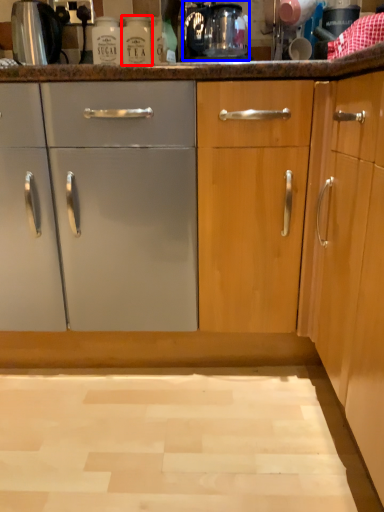
Question: Which of the following is the closest to the observer, bottle (highlighted by a red box) or coffee machine (highlighted by a blue box)?

Choices:
 (A) bottle
 (B) coffee machine

Answer: (B)